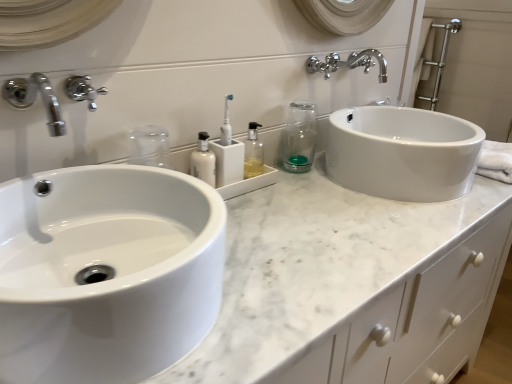
Question: From a real-world perspective, relative to translucent plastic bottle at center, is polished chrome faucet at upper center vertically above or below?

Choices:
 (A) above
 (B) below

Answer: (A)

Question: Do you think polished chrome faucet at upper center is within translucent plastic bottle at center, or outside of it?

Choices:
 (A) outside
 (B) inside

Answer: (A)

Question: Which object is the closest to the polished chrome faucet at upper center?

Choices:
 (A) chrome/metallic faucet at upper left, which is the first tap in front-to-back order
 (B) chrome/metallic faucet at upper left, marked as the first tap in a back-to-front arrangement
 (C) white matte bottle at center, positioned as the 2th mouthwash in right-to-left order
 (D) translucent plastic bottle at center
 (E) white marble countertop at center

Answer: (D)

Question: Considering the real-world distances, which object is farthest from the white glossy sink at left?

Choices:
 (A) chrome/metallic faucet at upper left, marked as the first tap in a back-to-front arrangement
 (B) white matte bottle at center, which is the 1th mouthwash from left to right
 (C) translucent plastic bottle at center
 (D) polished chrome faucet at upper center
 (E) white plastic toothbrush at center

Answer: (D)